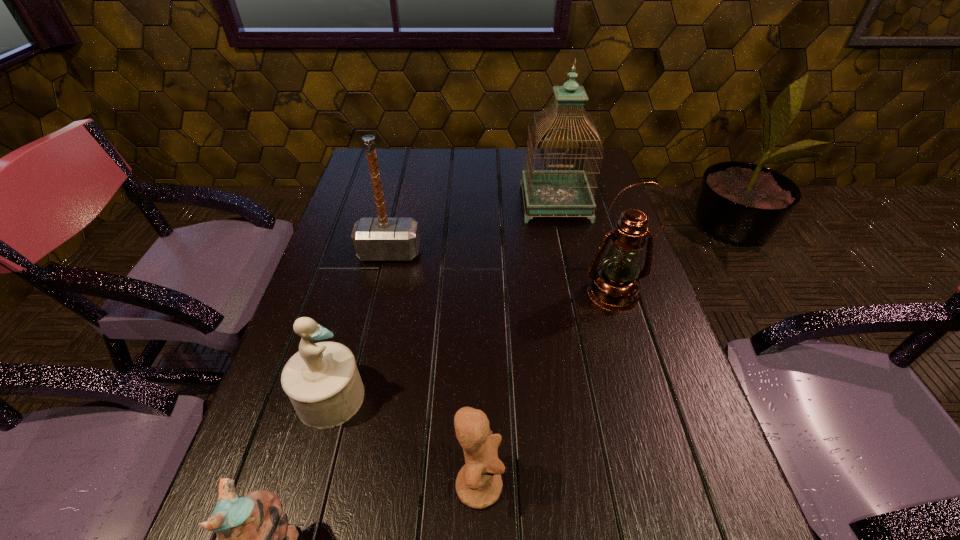
You are a GUI agent. You are given a task and a screenshot of the screen. Output one action in this format:
    pyautogui.click(x=<x>, y=<y>)
    Task: Click on the birdcage
    The image size is (960, 540).
    Given the screenshot: What is the action you would take?
    point(553,192)

The width and height of the screenshot is (960, 540). Find the location of `the farthest object`. the farthest object is located at coordinates (553, 192).

You are a GUI agent. You are given a task and a screenshot of the screen. Output one action in this format:
    pyautogui.click(x=<x>, y=<y>)
    Task: Click on the fifth nearest object
    
    Given the screenshot: What is the action you would take?
    pyautogui.click(x=374, y=239)

The image size is (960, 540). In order to click on the third farthest object in this screenshot , I will do `click(615, 285)`.

The image size is (960, 540). In order to click on the third nearest object in this screenshot , I will do `click(322, 381)`.

Image resolution: width=960 pixels, height=540 pixels. I want to click on the third object from right to left, so click(x=479, y=484).

At what (x,y) coordinates should I click in order to perform the action: click on the rightmost figurine. Please return your answer as a coordinate pair (x, y). Image resolution: width=960 pixels, height=540 pixels. Looking at the image, I should click on (479, 484).

The height and width of the screenshot is (540, 960). I want to click on vacant region located 0.080m at the door of the tallest object, so click(564, 241).

I want to click on vacant space located on the striking surface of the hammer, so click(375, 314).

The height and width of the screenshot is (540, 960). In order to click on free space located 0.380m on the front of the fourth nearest object in this screenshot , I will do `click(669, 482)`.